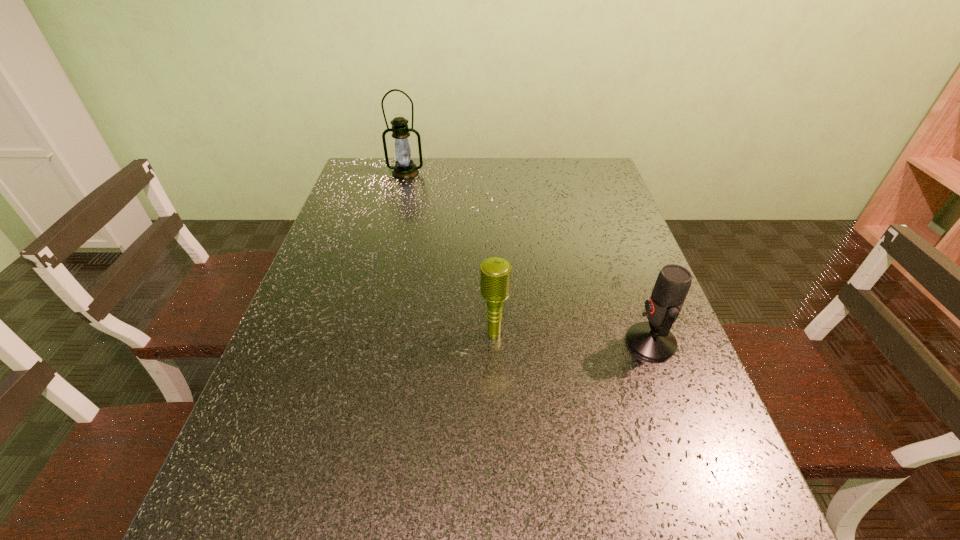
You are a GUI agent. You are given a task and a screenshot of the screen. Output one action in this format:
    pyautogui.click(x=<x>, y=<y>)
    Task: Click on the vacant point located between the rightmost object and the lantern
    The image size is (960, 540).
    Given the screenshot: What is the action you would take?
    pyautogui.click(x=528, y=258)

Where is `vacant area that lies between the second object from left to right and the tallest object`? vacant area that lies between the second object from left to right and the tallest object is located at coordinates (450, 253).

This screenshot has width=960, height=540. I want to click on vacant space that's between the right microphone and the second object from left to right, so click(x=572, y=338).

Where is `free space between the leftmost object and the right microphone`? The height and width of the screenshot is (540, 960). free space between the leftmost object and the right microphone is located at coordinates (528, 258).

The height and width of the screenshot is (540, 960). Identify the location of empty space between the second object from right to left and the rightmost object. (572, 338).

You are a GUI agent. You are given a task and a screenshot of the screen. Output one action in this format:
    pyautogui.click(x=<x>, y=<y>)
    Task: Click on the free space between the second object from right to left and the leftmost object
    This screenshot has height=540, width=960.
    Given the screenshot: What is the action you would take?
    pyautogui.click(x=450, y=253)

At what (x,y) coordinates should I click in order to perform the action: click on free spot between the leftmost object and the right microphone. Please return your answer as a coordinate pair (x, y). The width and height of the screenshot is (960, 540). Looking at the image, I should click on (528, 258).

This screenshot has width=960, height=540. In order to click on object that stands as the second closest to the lantern in this screenshot , I will do `click(653, 341)`.

The image size is (960, 540). Find the location of `object that stands as the second closest to the tallest object`. object that stands as the second closest to the tallest object is located at coordinates (653, 341).

At what (x,y) coordinates should I click in order to perform the action: click on free space that satisfies the following two spatial constraints: 1. on the side where the left microphone emits light; 2. on the right side of the farthest object. Please return your answer as a coordinate pair (x, y). Looking at the image, I should click on (365, 334).